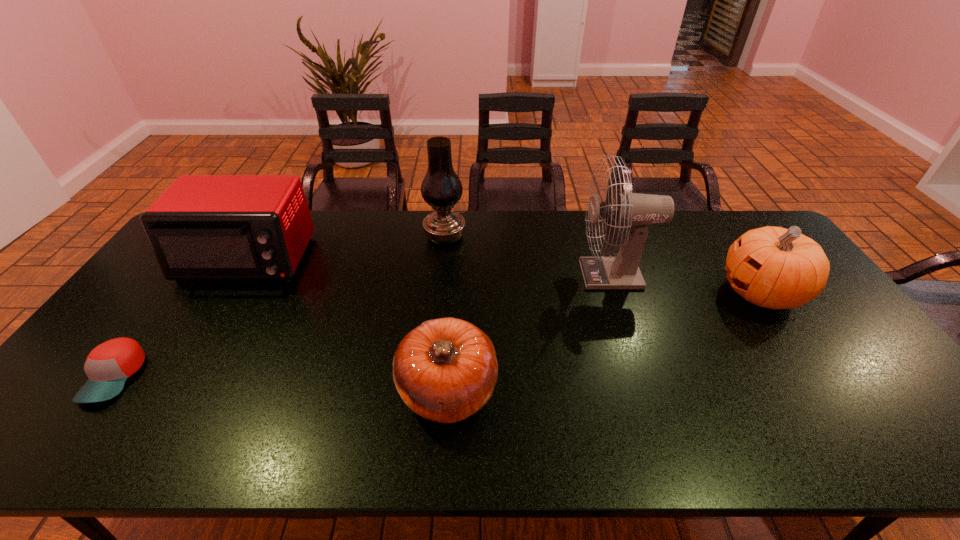
I want to click on free point located on the air flow direction of the fan, so click(x=496, y=274).

Find the location of a particular element. This screenshot has height=540, width=960. free spot located on the front of the oil lamp is located at coordinates (437, 320).

Locate an element on the screen. This screenshot has height=540, width=960. vacant region located 0.170m on the front-facing side of the toaster oven is located at coordinates (202, 334).

The width and height of the screenshot is (960, 540). Find the location of `free space located 0.240m on the front-facing side of the rightmost object`. free space located 0.240m on the front-facing side of the rightmost object is located at coordinates (639, 292).

Identify the location of free location located on the front-facing side of the rightmost object. (660, 292).

Locate an element on the screen. vacant space situated 0.090m on the front-facing side of the rightmost object is located at coordinates (689, 292).

Where is `free location located 0.210m on the back of the second shortest object`? Image resolution: width=960 pixels, height=540 pixels. free location located 0.210m on the back of the second shortest object is located at coordinates 453,294.

Locate an element on the screen. fan situated at the far edge is located at coordinates (637, 211).

The width and height of the screenshot is (960, 540). What are the coordinates of `oil lamp located in the far edge section of the desktop` in the screenshot? It's located at (441, 188).

The image size is (960, 540). In order to click on toaster oven present at the far edge in this screenshot , I will do `click(203, 227)`.